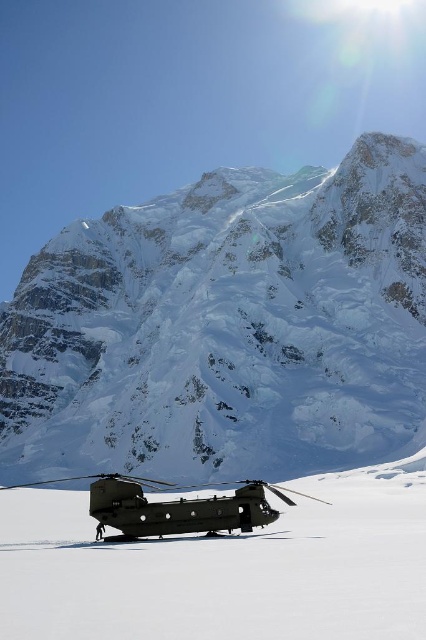
Who is more forward, (118, 388) or (31, 600)?

Point (31, 600)

Is snowy granite mountain range at center wider than matte black helicopter at lower center?

Yes.

Locate an element on the screen. Image resolution: width=426 pixels, height=640 pixels. snowy granite mountain range at center is located at coordinates (226, 326).

Is point (391, 488) positioned in front of point (104, 486)?

No.

Does matte black helicopter at lower center have a smaller size compared to matte black helicopter at center?

No.

Find the location of a particular element. The width and height of the screenshot is (426, 640). matte black helicopter at lower center is located at coordinates (224, 566).

I want to click on matte black helicopter at lower center, so coord(224,566).

Who is more distant from viewer, (x=164, y=321) or (x=166, y=509)?

Positioned behind is point (x=164, y=321).

Can you confirm if snowy granite mountain range at center is thinner than matte black helicopter at center?

No.

Does point (271, 328) come closer to viewer compared to point (219, 484)?

No.

Where is `snowy granite mountain range at center`? This screenshot has width=426, height=640. snowy granite mountain range at center is located at coordinates (226, 326).